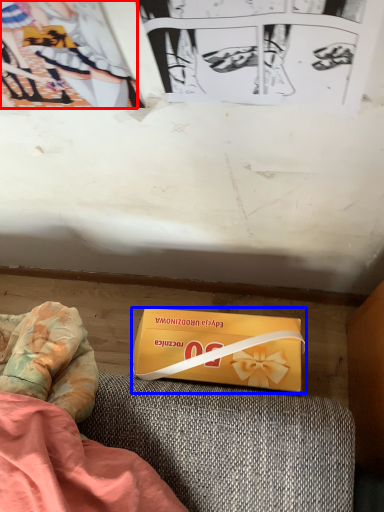
Question: Which object is closer to the camera taking this photo, couple (highlighted by a red box) or box (highlighted by a blue box)?

Choices:
 (A) couple
 (B) box

Answer: (A)